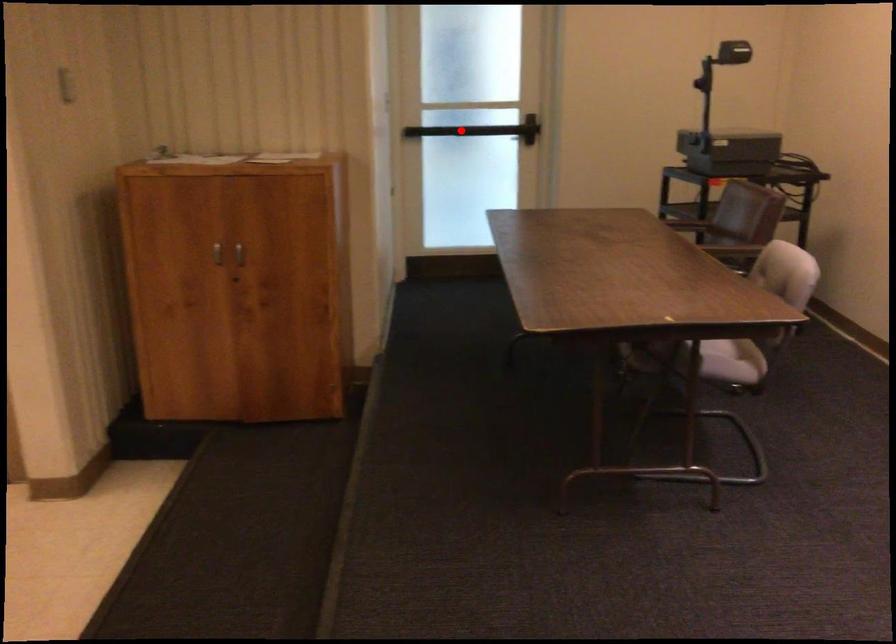
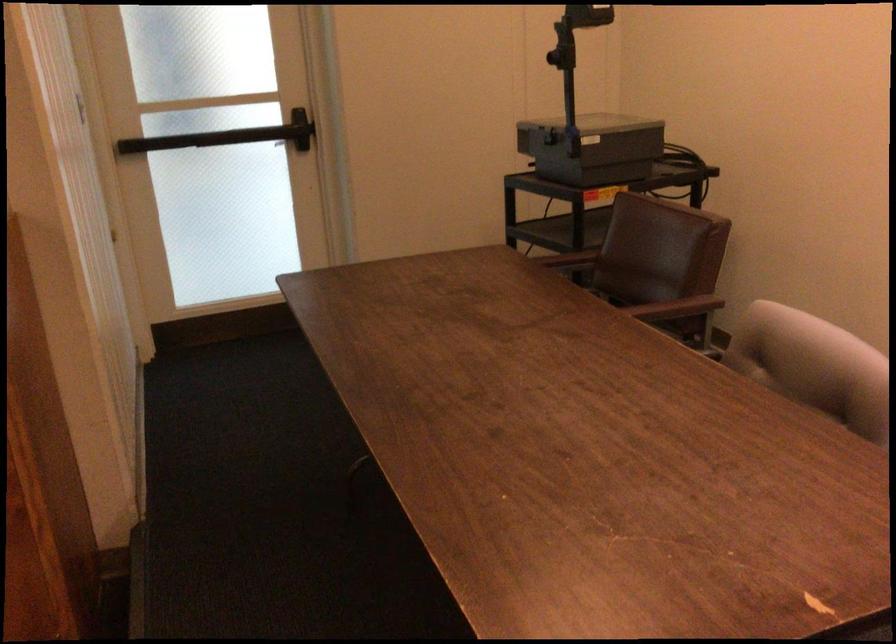
Question: I am providing you with two images of the same scene from different viewpoints. Given a red point in image1, look at the same physical point in image2. Is it:

Choices:
 (A) Closer to the viewpoint
 (B) Farther from the viewpoint

Answer: (A)